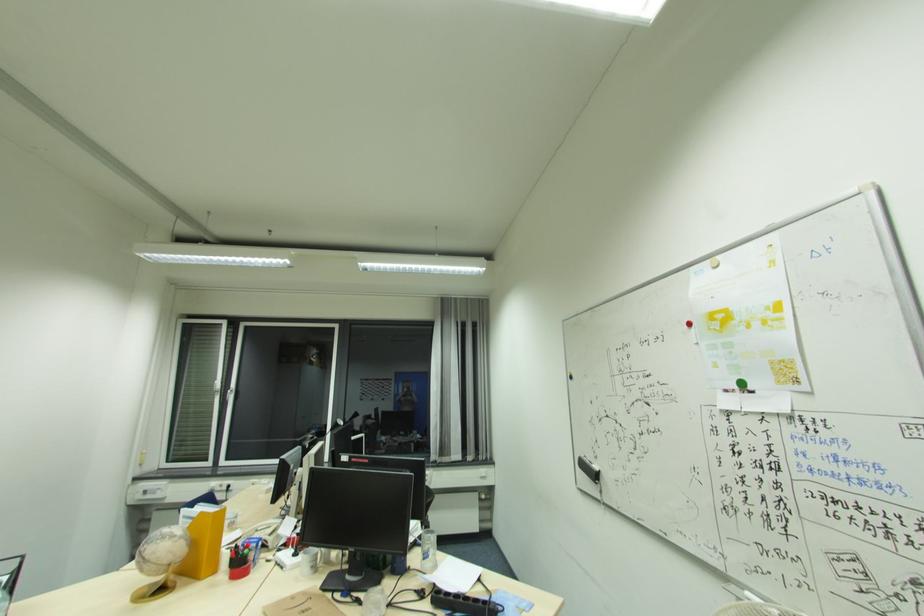
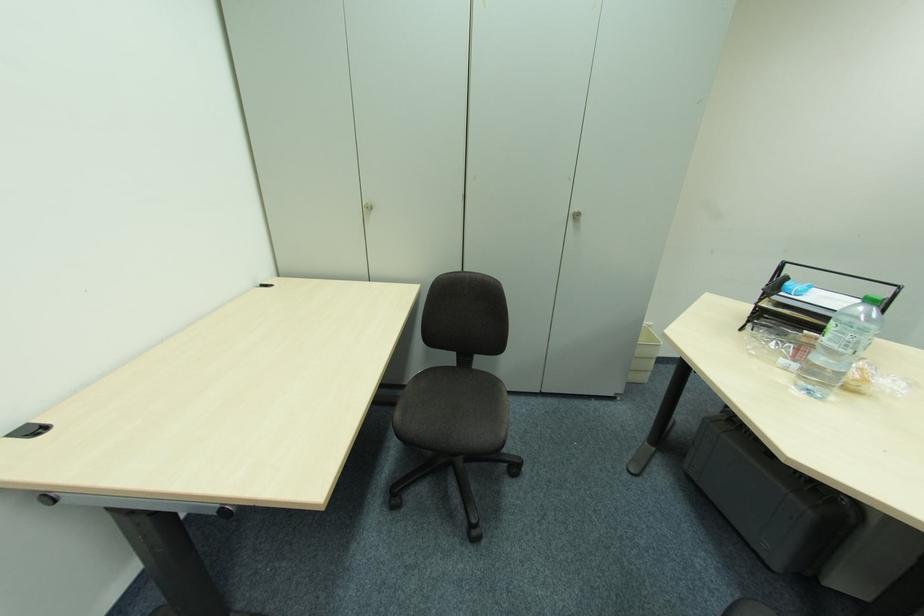
First-person continuous shooting, in which direction is the camera rotating?

The camera rotated toward left-down.